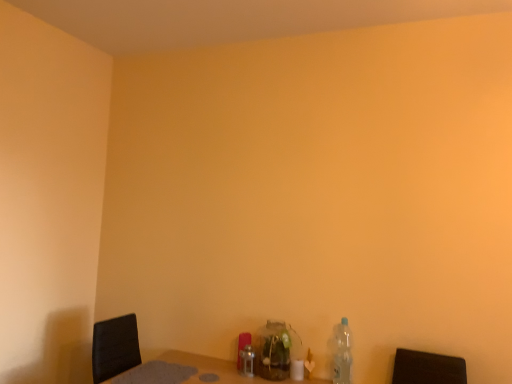
How much space does brushed metal bottle at center, the third bottle when ordered from right to left, occupy vertically?

brushed metal bottle at center, the third bottle when ordered from right to left, is 6.02 inches in height.

Where is `clear plastic bottle at lower right, the first bottle viewed from the right`? The width and height of the screenshot is (512, 384). clear plastic bottle at lower right, the first bottle viewed from the right is located at coordinates (341, 353).

Identify the location of brushed metal bottle at center, arranged as the first bottle when viewed from the left. The width and height of the screenshot is (512, 384). (247, 361).

From a real-world perspective, which is physically above, translucent glass jar at center, the 2th bottle in the right-to-left sequence, or brushed metal bottle at center, the third bottle when ordered from right to left?

translucent glass jar at center, the 2th bottle in the right-to-left sequence, is physically above.

Is point (285, 339) positioned after point (251, 355)?

No, it is in front of (251, 355).

Could you tell me if translucent glass jar at center, the 2th bottle in the right-to-left sequence, is facing brushed metal bottle at center, arranged as the first bottle when viewed from the left?

No.

Consider the image. In the image, is clear plastic bottle at lower right, marked as the third bottle in a left-to-right arrangement, positioned in front of or behind brushed metal bottle at center, the third bottle when ordered from right to left?

clear plastic bottle at lower right, marked as the third bottle in a left-to-right arrangement, is in front of brushed metal bottle at center, the third bottle when ordered from right to left.

From a real-world perspective, between clear plastic bottle at lower right, the first bottle viewed from the right, and brushed metal bottle at center, the third bottle when ordered from right to left, who is vertically higher?

In real-world perspective, clear plastic bottle at lower right, the first bottle viewed from the right, is above.

Which of these two, clear plastic bottle at lower right, marked as the third bottle in a left-to-right arrangement, or brushed metal bottle at center, the third bottle when ordered from right to left, is thinner?

clear plastic bottle at lower right, marked as the third bottle in a left-to-right arrangement, is thinner.

Consider the image. Considering the sizes of clear plastic bottle at lower right, the first bottle viewed from the right, and translucent glass jar at center, placed as the second bottle when sorted from left to right, in the image, is clear plastic bottle at lower right, the first bottle viewed from the right, taller or shorter than translucent glass jar at center, placed as the second bottle when sorted from left to right,?

Clearly, clear plastic bottle at lower right, the first bottle viewed from the right, is taller compared to translucent glass jar at center, placed as the second bottle when sorted from left to right.

Consider the image. Is clear plastic bottle at lower right, the first bottle viewed from the right, thinner than translucent glass jar at center, placed as the second bottle when sorted from left to right?

Yes, clear plastic bottle at lower right, the first bottle viewed from the right, is thinner than translucent glass jar at center, placed as the second bottle when sorted from left to right.

Are clear plastic bottle at lower right, the first bottle viewed from the right, and translucent glass jar at center, the 2th bottle in the right-to-left sequence, far apart?

No, there isn't a large distance between clear plastic bottle at lower right, the first bottle viewed from the right, and translucent glass jar at center, the 2th bottle in the right-to-left sequence.

Is translucent glass jar at center, placed as the second bottle when sorted from left to right, a part of clear plastic bottle at lower right, marked as the third bottle in a left-to-right arrangement?

Actually, translucent glass jar at center, placed as the second bottle when sorted from left to right, is outside clear plastic bottle at lower right, marked as the third bottle in a left-to-right arrangement.

From the image's perspective, who appears lower, brushed metal bottle at center, the third bottle when ordered from right to left, or translucent glass jar at center, the 2th bottle in the right-to-left sequence?

From the image's view, brushed metal bottle at center, the third bottle when ordered from right to left, is below.

Can you confirm if brushed metal bottle at center, the third bottle when ordered from right to left, is wider than translucent glass jar at center, the 2th bottle in the right-to-left sequence?

No, brushed metal bottle at center, the third bottle when ordered from right to left, is not wider than translucent glass jar at center, the 2th bottle in the right-to-left sequence.

Image resolution: width=512 pixels, height=384 pixels. Identify the location of the 1st bottle positioned above the brushed metal bottle at center, arranged as the first bottle when viewed from the left (from a real-world perspective). (273, 351).

Does brushed metal bottle at center, arranged as the first bottle when viewed from the left, appear on the left side of translucent glass jar at center, the 2th bottle in the right-to-left sequence?

Yes, brushed metal bottle at center, arranged as the first bottle when viewed from the left, is to the left of translucent glass jar at center, the 2th bottle in the right-to-left sequence.

Is brushed metal bottle at center, arranged as the first bottle when viewed from the left, touching clear plastic bottle at lower right, the first bottle viewed from the right?

No, brushed metal bottle at center, arranged as the first bottle when viewed from the left, is not beside clear plastic bottle at lower right, the first bottle viewed from the right.

Consider the image. Is brushed metal bottle at center, arranged as the first bottle when viewed from the left, closer to camera compared to clear plastic bottle at lower right, marked as the third bottle in a left-to-right arrangement?

No, it is not.

Considering the relative sizes of brushed metal bottle at center, the third bottle when ordered from right to left, and clear plastic bottle at lower right, marked as the third bottle in a left-to-right arrangement, in the image provided, is brushed metal bottle at center, the third bottle when ordered from right to left, wider than clear plastic bottle at lower right, marked as the third bottle in a left-to-right arrangement,?

Indeed, brushed metal bottle at center, the third bottle when ordered from right to left, has a greater width compared to clear plastic bottle at lower right, marked as the third bottle in a left-to-right arrangement.

How different are the orientations of brushed metal bottle at center, the third bottle when ordered from right to left, and clear plastic bottle at lower right, marked as the third bottle in a left-to-right arrangement, in degrees?

brushed metal bottle at center, the third bottle when ordered from right to left, and clear plastic bottle at lower right, marked as the third bottle in a left-to-right arrangement, are facing 0.866 degrees away from each other.

Is translucent glass jar at center, the 2th bottle in the right-to-left sequence, looking in the opposite direction of clear plastic bottle at lower right, the first bottle viewed from the right?

No, clear plastic bottle at lower right, the first bottle viewed from the right, is not at the back of translucent glass jar at center, the 2th bottle in the right-to-left sequence.

How much distance is there between translucent glass jar at center, the 2th bottle in the right-to-left sequence, and clear plastic bottle at lower right, the first bottle viewed from the right?

translucent glass jar at center, the 2th bottle in the right-to-left sequence, is 11.47 inches away from clear plastic bottle at lower right, the first bottle viewed from the right.

From a real-world perspective, is translucent glass jar at center, placed as the second bottle when sorted from left to right, below clear plastic bottle at lower right, marked as the third bottle in a left-to-right arrangement?

Yes, from a real-world perspective, translucent glass jar at center, placed as the second bottle when sorted from left to right, is beneath clear plastic bottle at lower right, marked as the third bottle in a left-to-right arrangement.

Does translucent glass jar at center, placed as the second bottle when sorted from left to right, have a smaller size compared to clear plastic bottle at lower right, the first bottle viewed from the right?

Actually, translucent glass jar at center, placed as the second bottle when sorted from left to right, might be larger than clear plastic bottle at lower right, the first bottle viewed from the right.

This screenshot has height=384, width=512. Find the location of `bottle below the translucent glass jar at center, placed as the second bottle when sorted from left to right (from the image's perspective)`. bottle below the translucent glass jar at center, placed as the second bottle when sorted from left to right (from the image's perspective) is located at coordinates (247, 361).

Starting from the clear plastic bottle at lower right, the first bottle viewed from the right, which bottle is the 2nd one behind? Please provide its 2D coordinates.

[(247, 361)]

In the scene shown: Which object lies nearer to the anchor point clear plastic bottle at lower right, marked as the third bottle in a left-to-right arrangement, brushed metal bottle at center, arranged as the first bottle when viewed from the left, or translucent glass jar at center, the 2th bottle in the right-to-left sequence?

The object closer to clear plastic bottle at lower right, marked as the third bottle in a left-to-right arrangement, is translucent glass jar at center, the 2th bottle in the right-to-left sequence.

Which object lies nearer to the anchor point translucent glass jar at center, the 2th bottle in the right-to-left sequence, clear plastic bottle at lower right, marked as the third bottle in a left-to-right arrangement, or brushed metal bottle at center, arranged as the first bottle when viewed from the left?

brushed metal bottle at center, arranged as the first bottle when viewed from the left.

Considering their positions, is translucent glass jar at center, the 2th bottle in the right-to-left sequence, positioned further to clear plastic bottle at lower right, marked as the third bottle in a left-to-right arrangement, than brushed metal bottle at center, the third bottle when ordered from right to left?

brushed metal bottle at center, the third bottle when ordered from right to left, is positioned further to the anchor clear plastic bottle at lower right, marked as the third bottle in a left-to-right arrangement.

Based on their spatial positions, is clear plastic bottle at lower right, the first bottle viewed from the right, or translucent glass jar at center, the 2th bottle in the right-to-left sequence, closer to brushed metal bottle at center, arranged as the first bottle when viewed from the left?

translucent glass jar at center, the 2th bottle in the right-to-left sequence, lies closer to brushed metal bottle at center, arranged as the first bottle when viewed from the left, than the other object.

Based on their spatial positions, is brushed metal bottle at center, the third bottle when ordered from right to left, or clear plastic bottle at lower right, the first bottle viewed from the right, further from translucent glass jar at center, the 2th bottle in the right-to-left sequence?

clear plastic bottle at lower right, the first bottle viewed from the right, is further to translucent glass jar at center, the 2th bottle in the right-to-left sequence.

Which object lies further to the anchor point brushed metal bottle at center, arranged as the first bottle when viewed from the left, translucent glass jar at center, placed as the second bottle when sorted from left to right, or clear plastic bottle at lower right, the first bottle viewed from the right?

Among the two, clear plastic bottle at lower right, the first bottle viewed from the right, is located further to brushed metal bottle at center, arranged as the first bottle when viewed from the left.

The image size is (512, 384). I want to click on bottle between brushed metal bottle at center, the third bottle when ordered from right to left, and clear plastic bottle at lower right, marked as the third bottle in a left-to-right arrangement, from left to right, so click(273, 351).